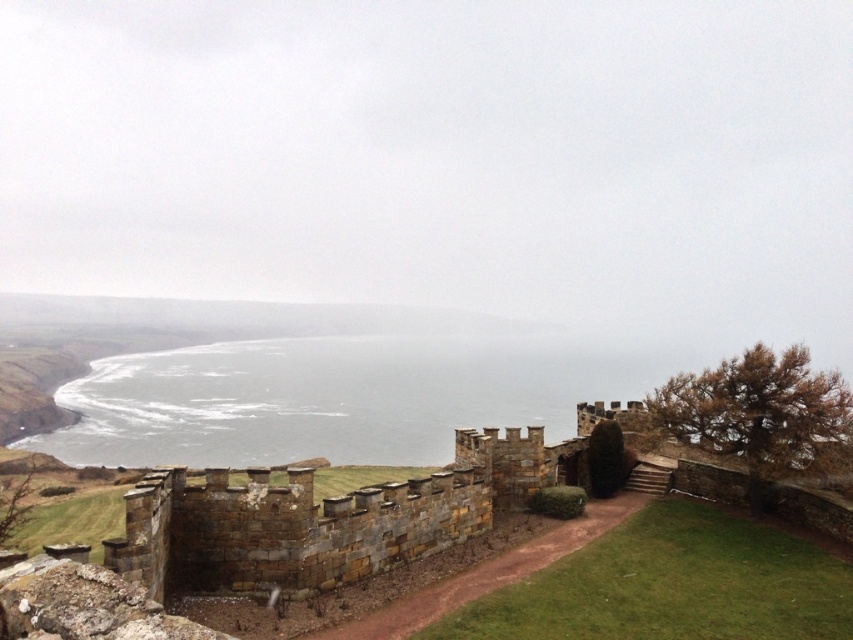
You are standing at the stone wall in the foreground of the scene. You want to walk directly towards the gray water at center. What direction should you head in relative to your current position?

Since the gray water at center is located at point 0.623 on the x axis and 0.389 on the y axis, you should head towards the center of the image to reach it.

You are standing at the point marked as point (331, 397) in the image. Based on the scene description, what type of terrain or surface are you currently standing on?

The point (331, 397) is on gray water at center, so you are standing on water.

You are standing on the pathway near the brown stone wall at center and want to cross to the other side of the gray water at center. Considering the size difference between the two, which object would you need to navigate around first?

The brown stone wall at center is smaller in size compared to the gray water at center, so you would need to navigate around the brown stone wall at center first before crossing the gray water at center.